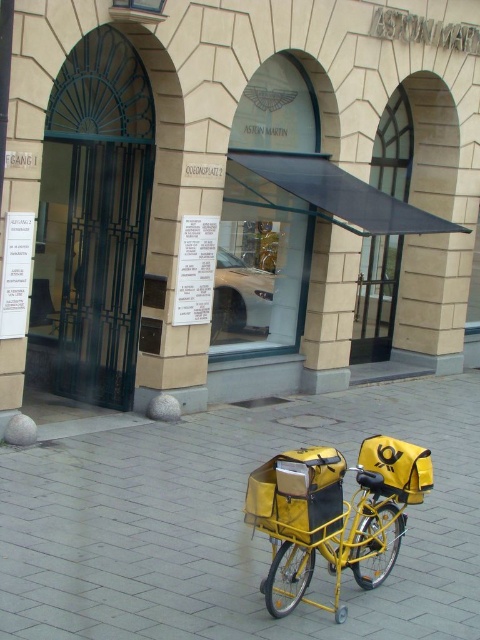
Who is positioned more to the left, yellow matte pavement at lower center or yellow matte bicycle at center?

yellow matte bicycle at center

Describe the element at coordinates (229, 524) in the screenshot. I see `yellow matte pavement at lower center` at that location.

The height and width of the screenshot is (640, 480). Find the location of `yellow matte pavement at lower center`. yellow matte pavement at lower center is located at coordinates (229, 524).

You are a GUI agent. You are given a task and a screenshot of the screen. Output one action in this format:
    pyautogui.click(x=<x>, y=<y>)
    Task: Click on the yellow matte pavement at lower center
    Image resolution: width=480 pixels, height=640 pixels.
    Given the screenshot: What is the action you would take?
    pyautogui.click(x=229, y=524)